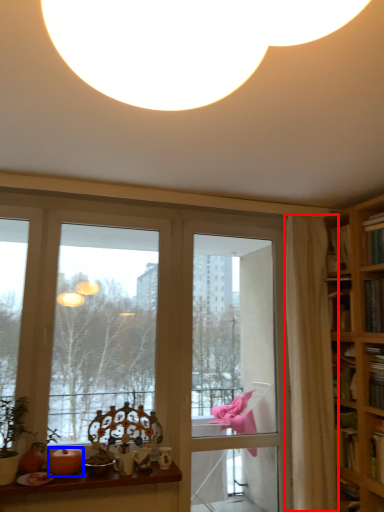
Question: Which object appears farthest to the camera in this image, curtain (highlighted by a red box) or pumpkin (highlighted by a blue box)?

Choices:
 (A) curtain
 (B) pumpkin

Answer: (A)